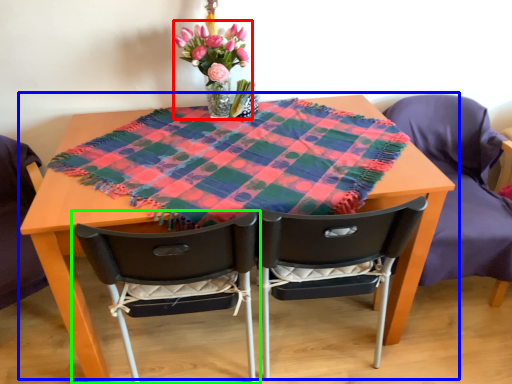
Question: Which object is the closest to the floral arrangement (highlighted by a red box)? Choose among these: table (highlighted by a blue box) or chair (highlighted by a green box).

Choices:
 (A) table
 (B) chair

Answer: (A)